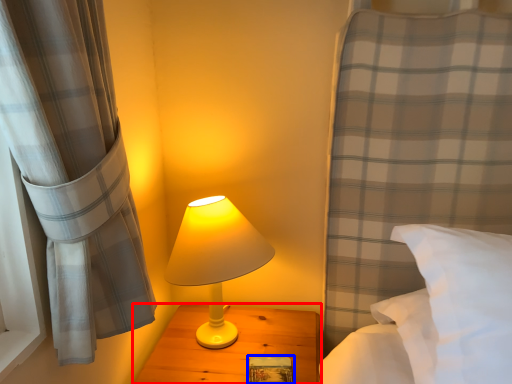
Question: Among these objects, which one is farthest to the camera, nightstand (highlighted by a red box) or book (highlighted by a blue box)?

Choices:
 (A) nightstand
 (B) book

Answer: (B)